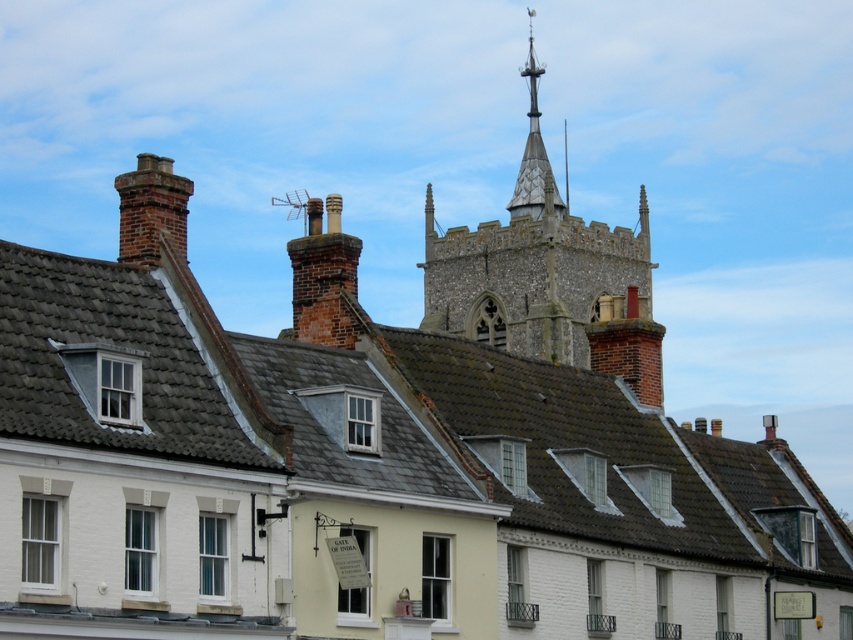
Does brick chimney at center have a lesser width compared to brick chimney at left?

In fact, brick chimney at center might be wider than brick chimney at left.

Is brick chimney at center smaller than brick chimney at left?

Yes.

Who is more forward, (320, 333) or (137, 218)?

Point (137, 218)

Where is `brick chimney at center`? The image size is (853, 640). brick chimney at center is located at coordinates (323, 280).

Is point (613, 259) positioned after point (294, 323)?

Yes, it is.

Who is more distant from viewer, (422, 275) or (315, 236)?

The point (422, 275) is more distant.

The height and width of the screenshot is (640, 853). What are the coordinates of `stone steeple at upper center` in the screenshot? It's located at (547, 276).

Can you confirm if stone steeple at upper center is shorter than brick chimney at left?

Incorrect, stone steeple at upper center's height does not fall short of brick chimney at left's.

Does stone steeple at upper center appear over brick chimney at left?

Correct, stone steeple at upper center is located above brick chimney at left.

This screenshot has height=640, width=853. What do you see at coordinates (547, 276) in the screenshot? I see `stone steeple at upper center` at bounding box center [547, 276].

Where is `stone steeple at upper center`? This screenshot has height=640, width=853. stone steeple at upper center is located at coordinates (547, 276).